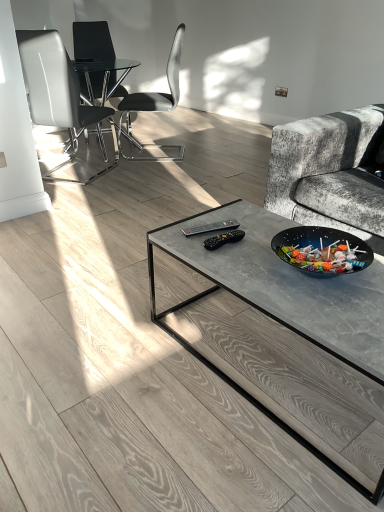
Question: From the image's perspective, is white leather chair at left, which is the 3th chair in back-to-front order, beneath black glass chair at upper left, arranged as the first chair when viewed from the back?

Choices:
 (A) yes
 (B) no

Answer: (A)

Question: Is white leather chair at left, acting as the first chair starting from the front, far from black glass chair at upper left, arranged as the first chair when viewed from the back?

Choices:
 (A) no
 (B) yes

Answer: (A)

Question: Can you see white leather chair at left, which is the 3th chair in back-to-front order, touching black glass chair at upper left, which is counted as the third chair, starting from the front?

Choices:
 (A) yes
 (B) no

Answer: (B)

Question: Is white leather chair at left, acting as the first chair starting from the front, shorter than black glass chair at upper left, which is counted as the third chair, starting from the front?

Choices:
 (A) yes
 (B) no

Answer: (A)

Question: Would you say white leather chair at left, acting as the first chair starting from the front, is outside black glass chair at upper left, arranged as the first chair when viewed from the back?

Choices:
 (A) no
 (B) yes

Answer: (B)

Question: Does point (122, 154) appear closer or farther from the camera than point (21, 34)?

Choices:
 (A) closer
 (B) farther

Answer: (B)

Question: Is black plastic chair at center, which is the second chair from front to back, spatially inside white leather chair at left, which is the 3th chair in back-to-front order, or outside of it?

Choices:
 (A) outside
 (B) inside

Answer: (A)

Question: Is black plastic chair at center, which is the second chair from front to back, taller or shorter than white leather chair at left, which is the 3th chair in back-to-front order?

Choices:
 (A) short
 (B) tall

Answer: (A)

Question: Is black plastic chair at center, which appears as the second chair when viewed from the back, bigger or smaller than white leather chair at left, acting as the first chair starting from the front?

Choices:
 (A) small
 (B) big

Answer: (B)

Question: Is black glass chair at upper left, which is counted as the third chair, starting from the front, to the left or to the right of black plastic chair at center, which is the second chair from front to back, in the image?

Choices:
 (A) left
 (B) right

Answer: (A)

Question: From their relative heights in the image, would you say black glass chair at upper left, arranged as the first chair when viewed from the back, is taller or shorter than black plastic chair at center, which appears as the second chair when viewed from the back?

Choices:
 (A) tall
 (B) short

Answer: (A)

Question: Is black glass chair at upper left, arranged as the first chair when viewed from the back, bigger or smaller than black plastic chair at center, which is the second chair from front to back?

Choices:
 (A) big
 (B) small

Answer: (A)

Question: In the image, is black glass chair at upper left, which is counted as the third chair, starting from the front, positioned in front of or behind black plastic chair at center, which is the second chair from front to back?

Choices:
 (A) front
 (B) behind

Answer: (B)

Question: Is white leather chair at left, acting as the first chair starting from the front, in front of or behind black glass chair at upper left, arranged as the first chair when viewed from the back, in the image?

Choices:
 (A) front
 (B) behind

Answer: (A)

Question: From the image's perspective, is white leather chair at left, which is the 3th chair in back-to-front order, located above or below black glass chair at upper left, arranged as the first chair when viewed from the back?

Choices:
 (A) below
 (B) above

Answer: (A)